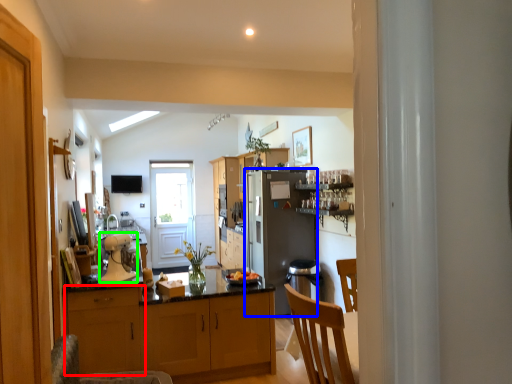
Question: Which object is the farthest from cabinetry (highlighted by a red box)? Choose among these: refrigerator (highlighted by a blue box) or kitchen appliance (highlighted by a green box).

Choices:
 (A) refrigerator
 (B) kitchen appliance

Answer: (A)